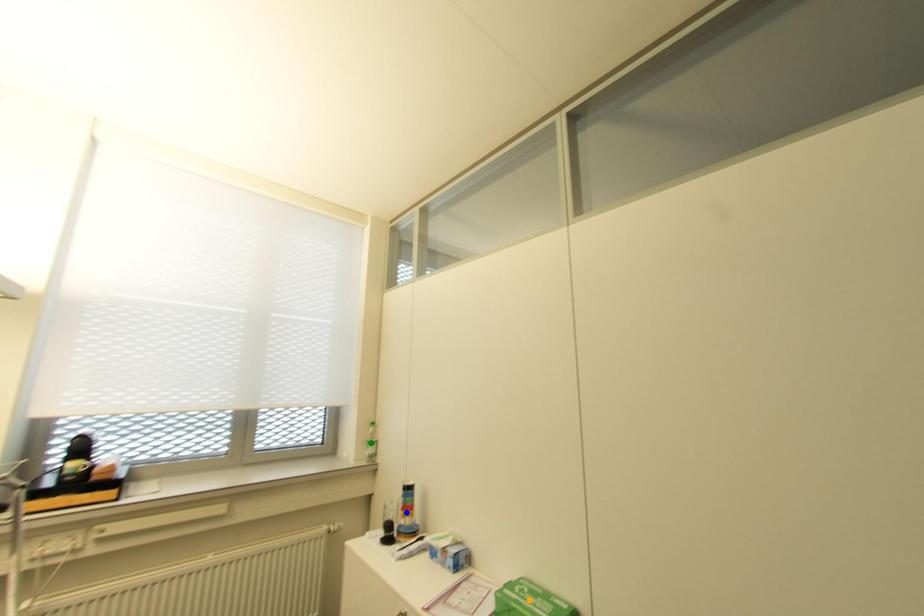
In the scene shown: Order these from farthest to nearest:
blue point, orange point, green point

1. green point
2. blue point
3. orange point